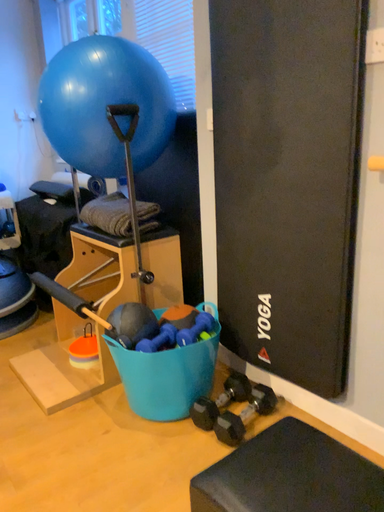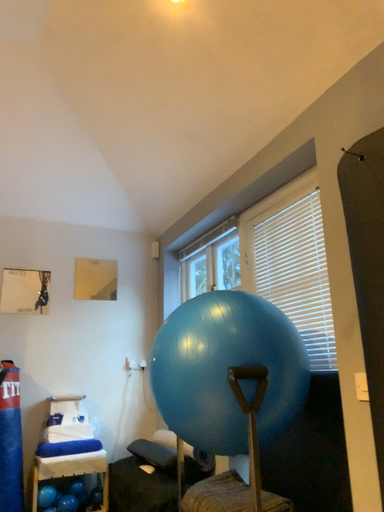
Question: Which way did the camera rotate in the video?

Choices:
 (A) rotated left
 (B) rotated right

Answer: (A)